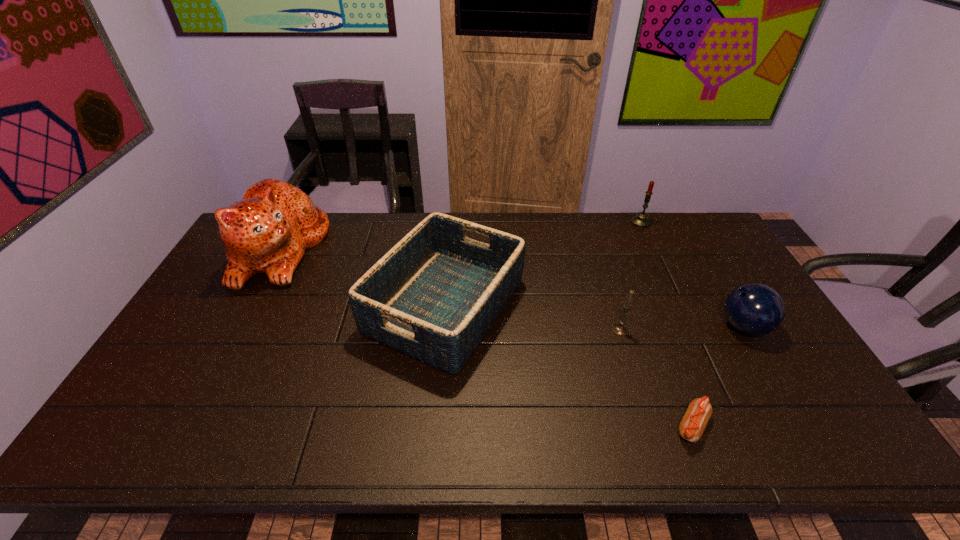
Where is `vacant space that satisfies the following two spatial constraints: 1. on the face of the fifth object from right to left; 2. on the left side of the leftmost object`? Image resolution: width=960 pixels, height=540 pixels. vacant space that satisfies the following two spatial constraints: 1. on the face of the fifth object from right to left; 2. on the left side of the leftmost object is located at coordinates (250, 306).

Find the location of a particular element. The height and width of the screenshot is (540, 960). vacant space that satisfies the following two spatial constraints: 1. on the face of the leftmost object; 2. on the back side of the second object from left to right is located at coordinates (250, 306).

At what (x,y) coordinates should I click in order to perform the action: click on free location that satisfies the following two spatial constraints: 1. on the face of the cat; 2. on the right side of the left candle. Please return your answer as a coordinate pair (x, y). Image resolution: width=960 pixels, height=540 pixels. Looking at the image, I should click on (236, 330).

Where is `free location that satisfies the following two spatial constraints: 1. on the front side of the basket; 2. on the right side of the third object from left to right`? The height and width of the screenshot is (540, 960). free location that satisfies the following two spatial constraints: 1. on the front side of the basket; 2. on the right side of the third object from left to right is located at coordinates (444, 330).